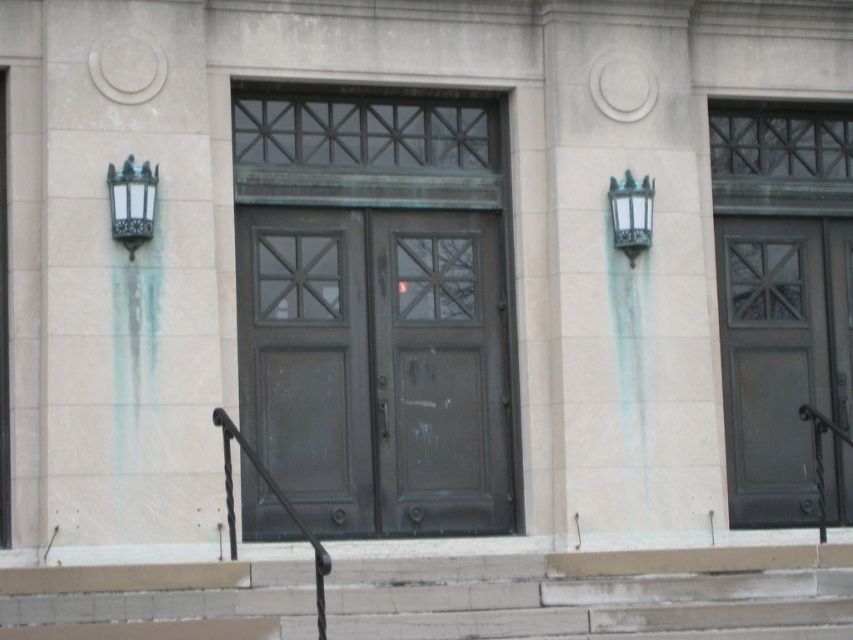
Is matte dark brown door at right above black wrought iron handrail at center?

Yes.

Who is taller, matte dark brown door at right or black wrought iron handrail at center?

matte dark brown door at right is taller.

What do you see at coordinates (781, 356) in the screenshot? The image size is (853, 640). I see `matte dark brown door at right` at bounding box center [781, 356].

Where is `matte dark brown door at right`? Image resolution: width=853 pixels, height=640 pixels. matte dark brown door at right is located at coordinates (781, 356).

Can you confirm if green patina doors at center is positioned below matte dark brown door at right?

Yes.

Measure the distance between point (381, 470) and camera.

The distance of point (381, 470) from camera is 15.21 meters.

You are a GUI agent. You are given a task and a screenshot of the screen. Output one action in this format:
    pyautogui.click(x=<x>, y=<y>)
    Task: Click on the green patina doors at center
    The height and width of the screenshot is (640, 853).
    Given the screenshot: What is the action you would take?
    pyautogui.click(x=376, y=365)

Where is `bronze textured lamp at upper left`? bronze textured lamp at upper left is located at coordinates (131, 202).

Is bronze textured lamp at upper left positioned in front of black wrought iron handrail at center?

No, bronze textured lamp at upper left is behind black wrought iron handrail at center.

Is point (149, 221) closer to camera compared to point (323, 634)?

That is False.

Where is `bronze textured lamp at upper left`? bronze textured lamp at upper left is located at coordinates (131, 202).